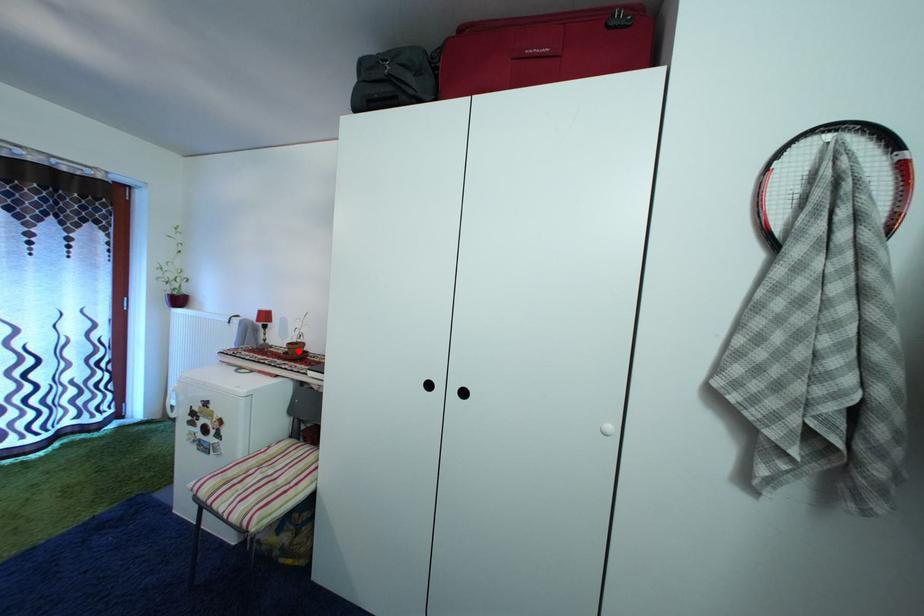
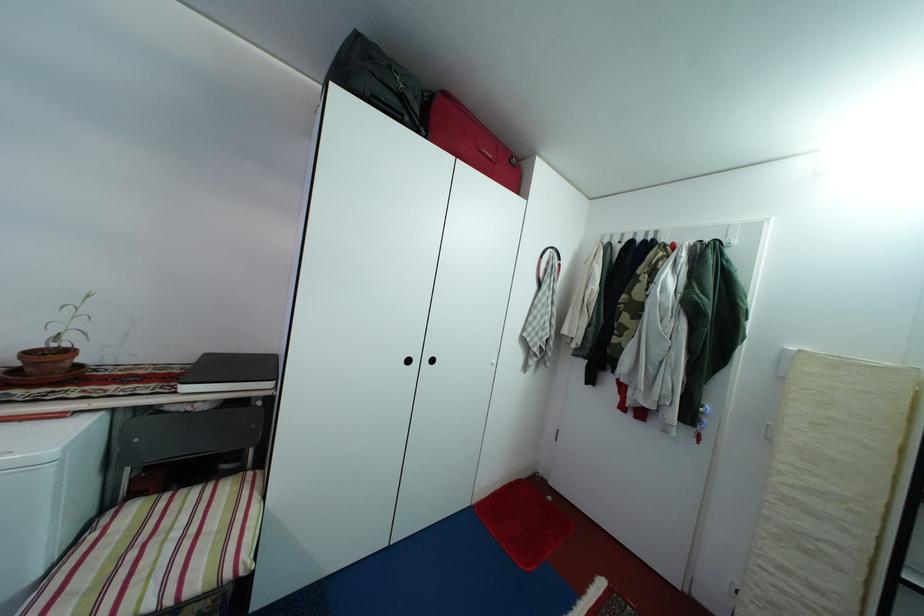
The point at the highlighted location is marked in the first image. Where is the corresponding point in the second image?

(38, 361)